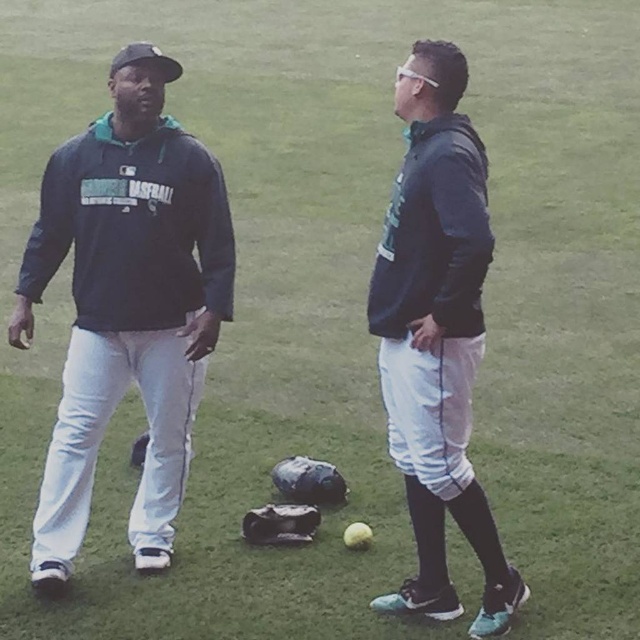
Does point (385, 301) lie in front of point (314, 516)?

Yes, it is in front of point (314, 516).

Does matte black jacket at center have a greater height compared to leather textured glove at center?

Yes.

Is point (444, 97) positioned behind point (275, 540)?

No, (444, 97) is in front of (275, 540).

Where is `matte black jacket at center`? This screenshot has height=640, width=640. matte black jacket at center is located at coordinates (436, 336).

Which is above, matte black jacket at center or dark gray leather glove at center?

matte black jacket at center is above.

Is matte black jacket at center bigger than dark gray leather glove at center?

Correct, matte black jacket at center is larger in size than dark gray leather glove at center.

Image resolution: width=640 pixels, height=640 pixels. In order to click on matte black jacket at center in this screenshot , I will do `click(436, 336)`.

You are a GUI agent. You are given a task and a screenshot of the screen. Output one action in this format:
    pyautogui.click(x=<x>, y=<y>)
    Task: Click on the matte black jacket at center
    The width and height of the screenshot is (640, 640).
    Given the screenshot: What is the action you would take?
    pyautogui.click(x=436, y=336)

Can you confirm if matte blue hoodie at left is positioned above leather textured glove at center?

Correct, matte blue hoodie at left is located above leather textured glove at center.

Does point (184, 260) come closer to viewer compared to point (273, 528)?

That is True.

Which is behind, point (180, 156) or point (308, 518)?

The point (308, 518) is more distant.

In order to click on matte blue hoodie at left in this screenshot , I will do tap(125, 301).